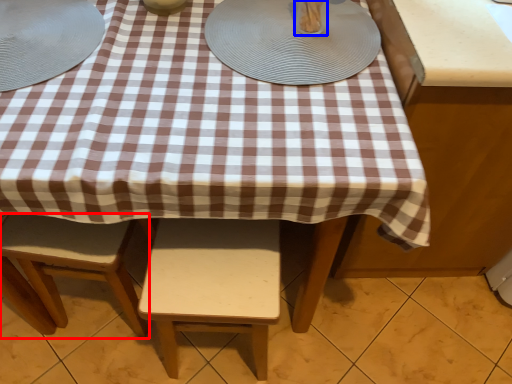
Question: Which object is closer to the camera taking this photo, stool (highlighted by a red box) or tableware (highlighted by a blue box)?

Choices:
 (A) stool
 (B) tableware

Answer: (B)